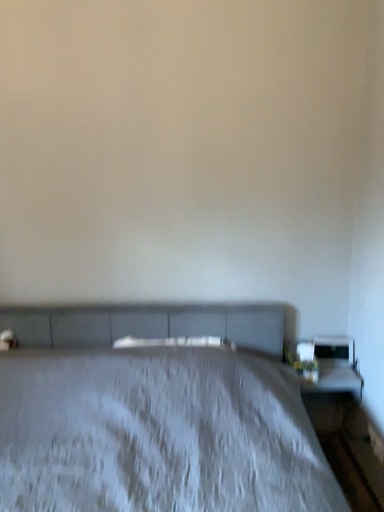
Image resolution: width=384 pixels, height=512 pixels. Find the location of `empty space that is ontop of white glossy table at right (from a real-world perspective)`. empty space that is ontop of white glossy table at right (from a real-world perspective) is located at coordinates (331, 372).